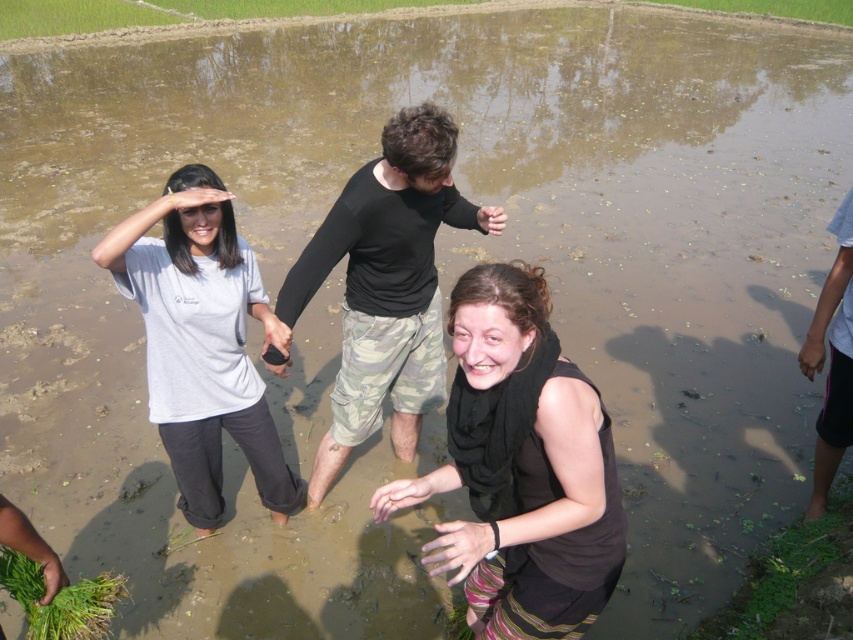
Question: Considering the real-world distances, which object is farthest from the black matte scarf at center?

Choices:
 (A) white matte shirt at left
 (B) black camo pants at center

Answer: (A)

Question: Among these points, which one is farthest from the camera?

Choices:
 (A) (424, 120)
 (B) (422, 486)
 (C) (189, 401)

Answer: (C)

Question: Can you confirm if black matte scarf at center is positioned to the right of black camo pants at center?

Choices:
 (A) no
 (B) yes

Answer: (B)

Question: Observing the image, what is the correct spatial positioning of black camo pants at center in reference to white matte shirt at left?

Choices:
 (A) below
 (B) above

Answer: (B)

Question: Is black matte scarf at center smaller than white matte shirt at left?

Choices:
 (A) yes
 (B) no

Answer: (A)

Question: Estimate the real-world distances between objects in this image. Which object is closer to the black camo pants at center?

Choices:
 (A) black matte scarf at center
 (B) white matte shirt at left

Answer: (B)